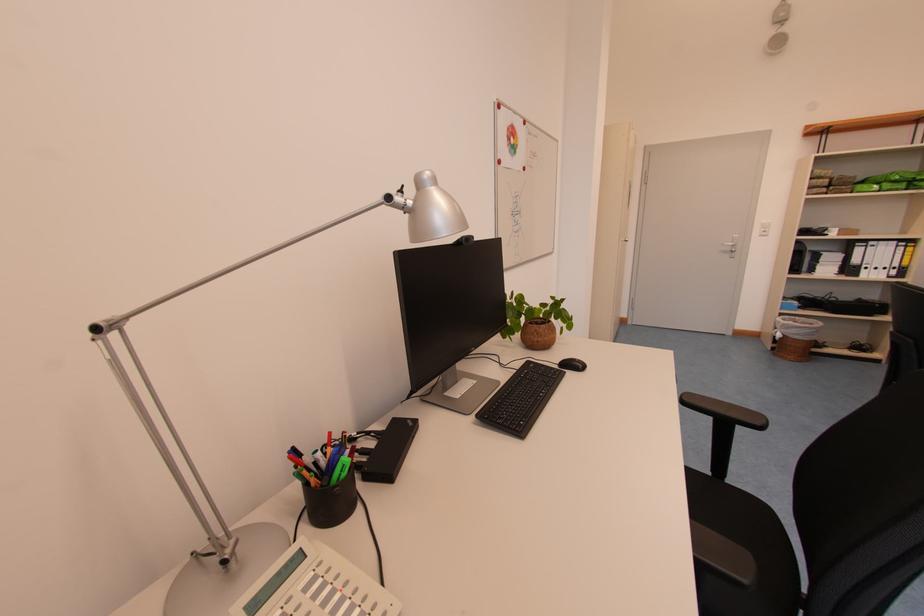
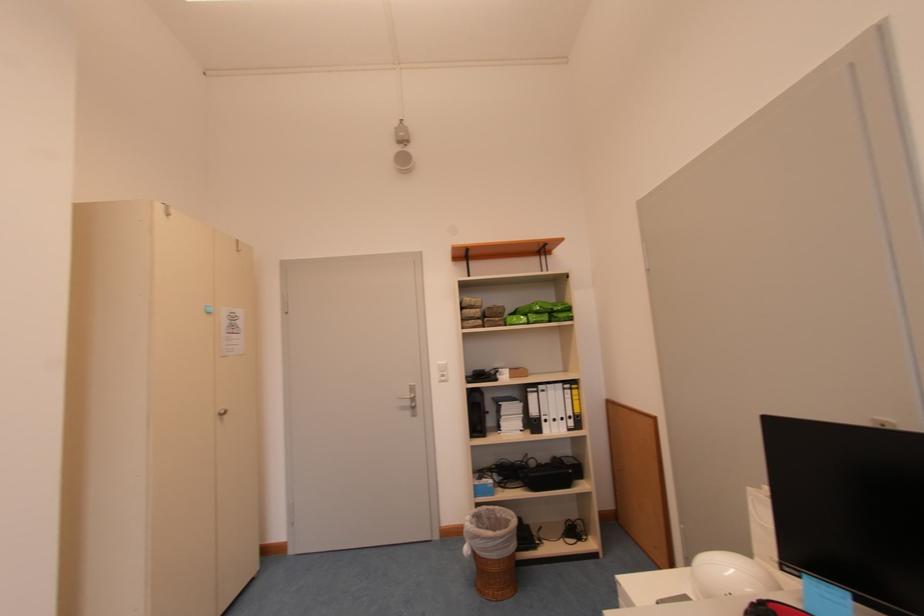
Where in the second image is the point corresponding to [862,264] from the first image?

(541, 415)